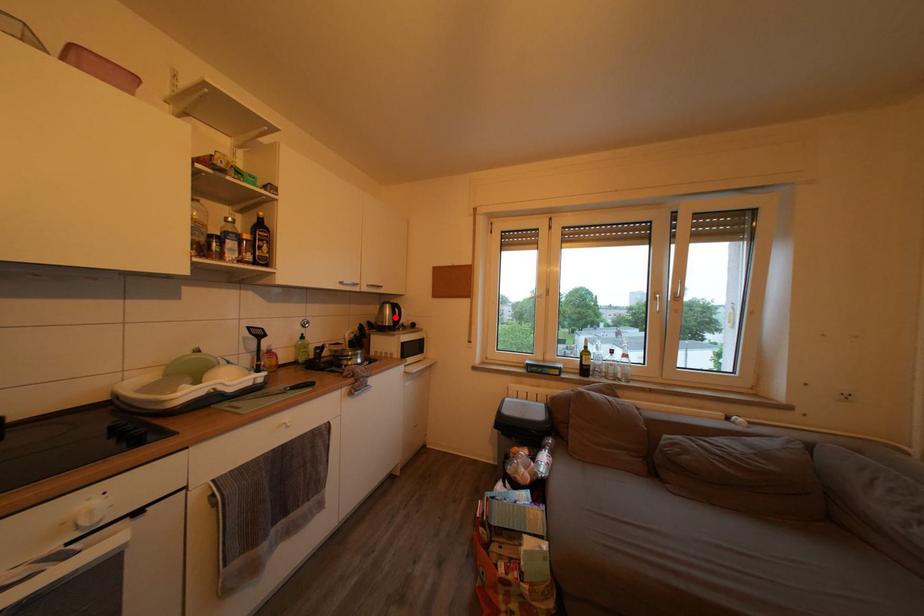
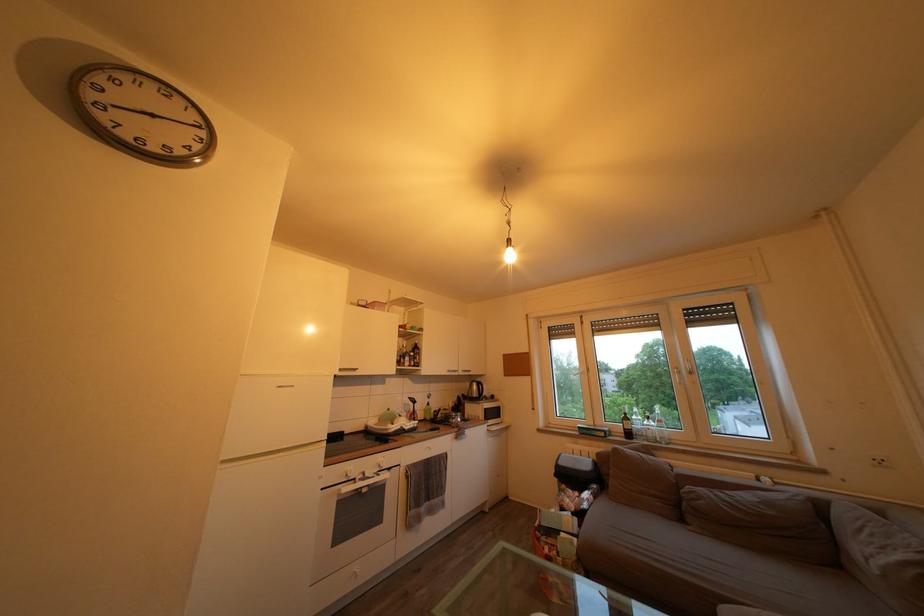
Question: I am providing you with two images of the same scene from different viewpoints. A red point is shown in image1. For the corresponding object point in image2, is it positioned nearer or farther from the camera?

Choices:
 (A) Nearer
 (B) Farther

Answer: (B)